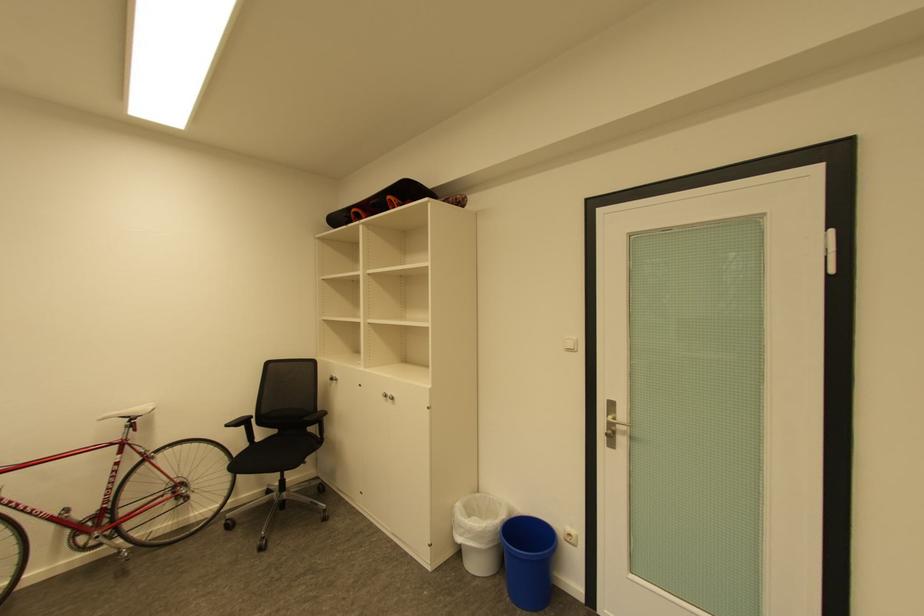
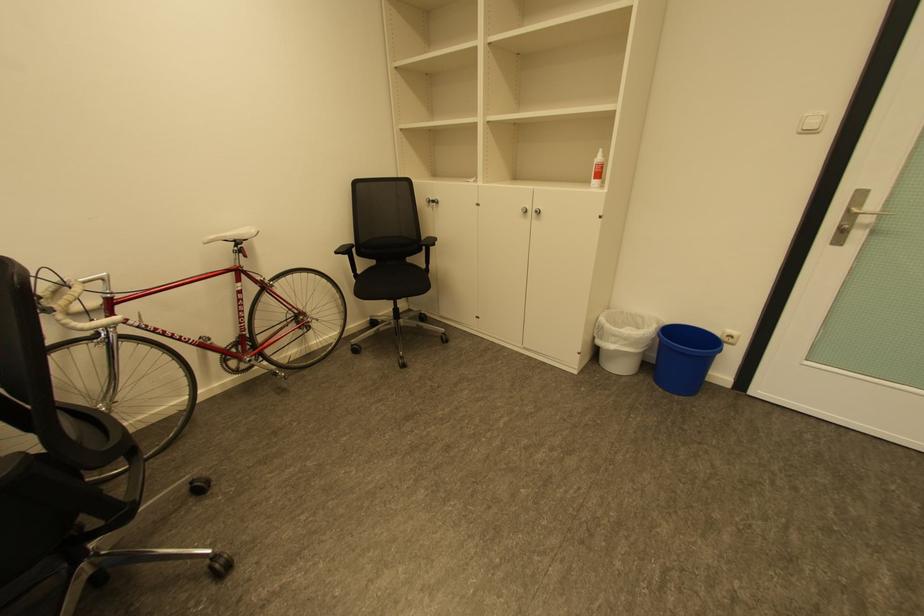
Question: In a continuous first-person perspective shot, in which direction is the camera moving?

Choices:
 (A) Left
 (B) Right
 (C) Forward
 (D) Backward

Answer: (A)